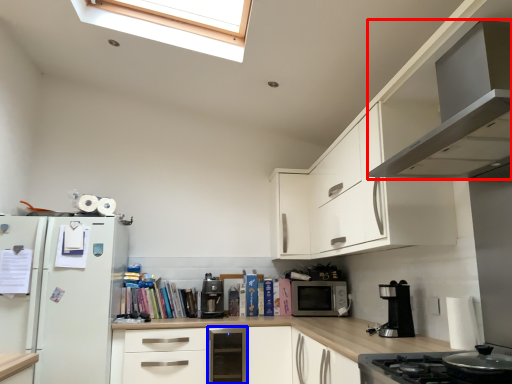
Question: Among these objects, which one is nearest to the camera, home appliance (highlighted by a red box) or dish washer (highlighted by a blue box)?

Choices:
 (A) home appliance
 (B) dish washer

Answer: (A)